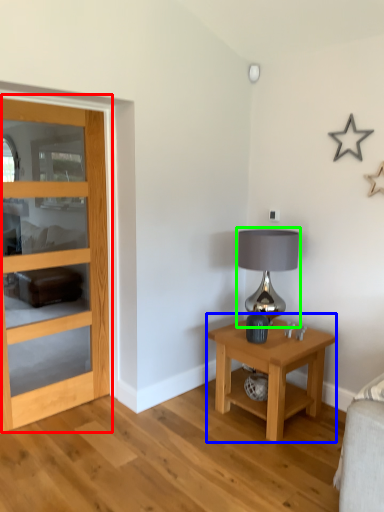
Question: Based on their relative distances, which object is nearer to door (highlighted by a red box)? Choose from nightstand (highlighted by a blue box) and table lamp (highlighted by a green box).

Choices:
 (A) nightstand
 (B) table lamp

Answer: (A)